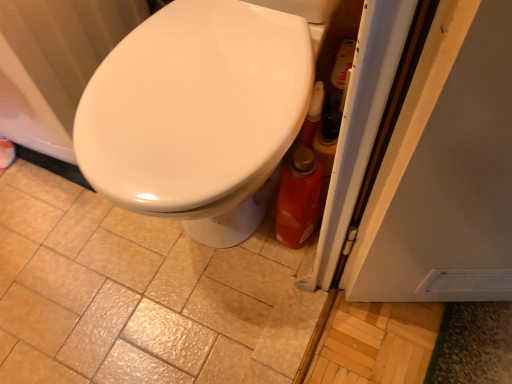
Where is `vacant region above matte ceramic tile at center (from a real-world perspective)`? vacant region above matte ceramic tile at center (from a real-world perspective) is located at coordinates (106, 278).